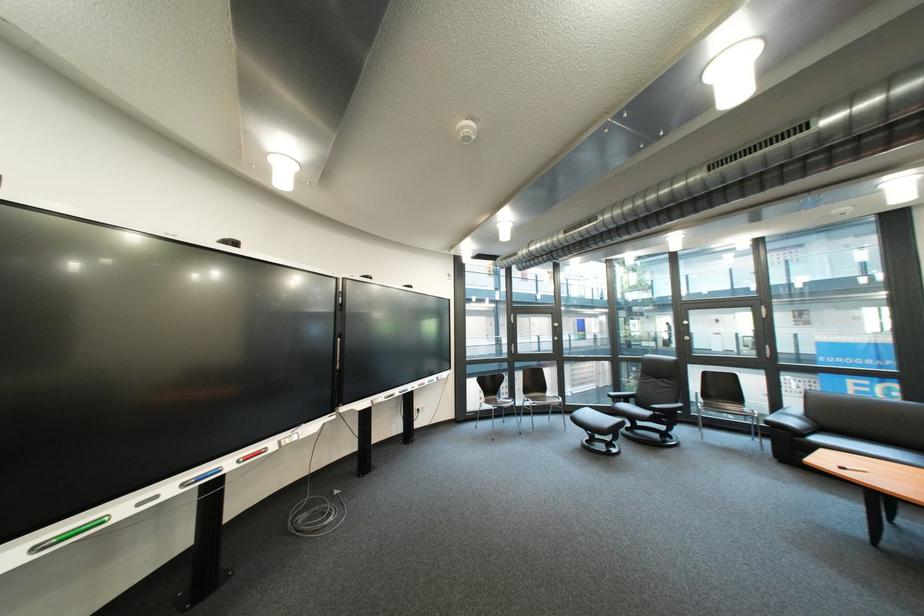
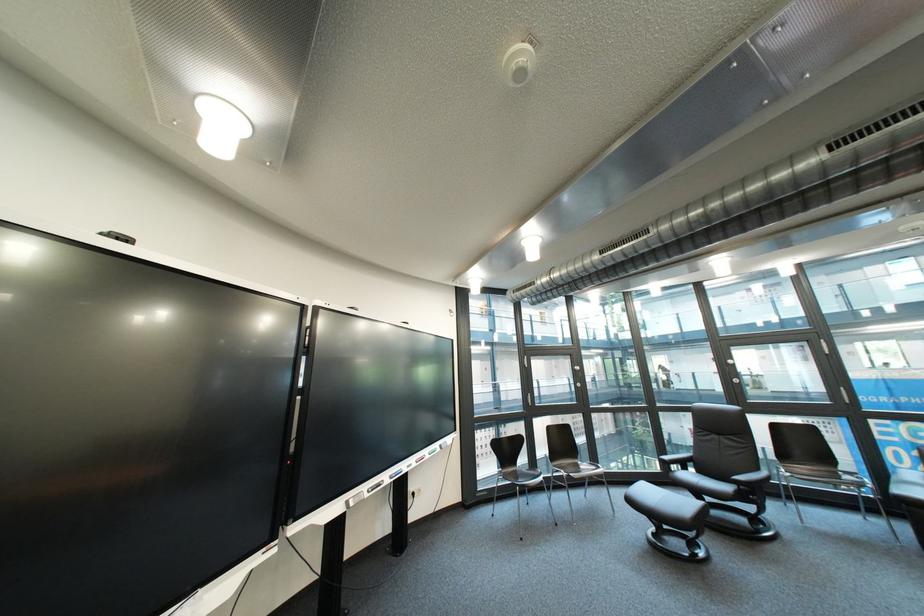
What movement of the cameraman would produce the second image?

The cameraman walked toward left, forward.